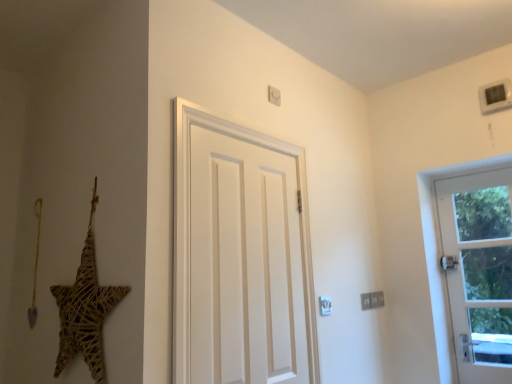
Question: From the image's perspective, is white glass door at right, placed as the 2th door when sorted from left to right, positioned above or below woven straw star at left?

Choices:
 (A) above
 (B) below

Answer: (B)

Question: From a real-world perspective, is white glass door at right, the first door from the right, above or below woven straw star at left?

Choices:
 (A) below
 (B) above

Answer: (A)

Question: Estimate the real-world distances between objects in this image. Which object is farther from the white glass door at right, the first door from the right?

Choices:
 (A) white matte door at center, the 2th door in the right-to-left sequence
 (B) woven straw star at left

Answer: (B)

Question: Considering the real-world distances, which object is farthest from the woven straw star at left?

Choices:
 (A) white glass door at right, the 1th door positioned from the back
 (B) white matte door at center, which appears as the first door when viewed from the left

Answer: (A)